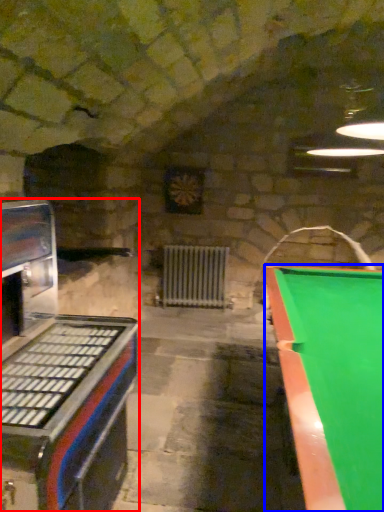
Question: Which point is closer to the camera, appliance (highlighted by a red box) or billiard table (highlighted by a blue box)?

Choices:
 (A) appliance
 (B) billiard table

Answer: (B)